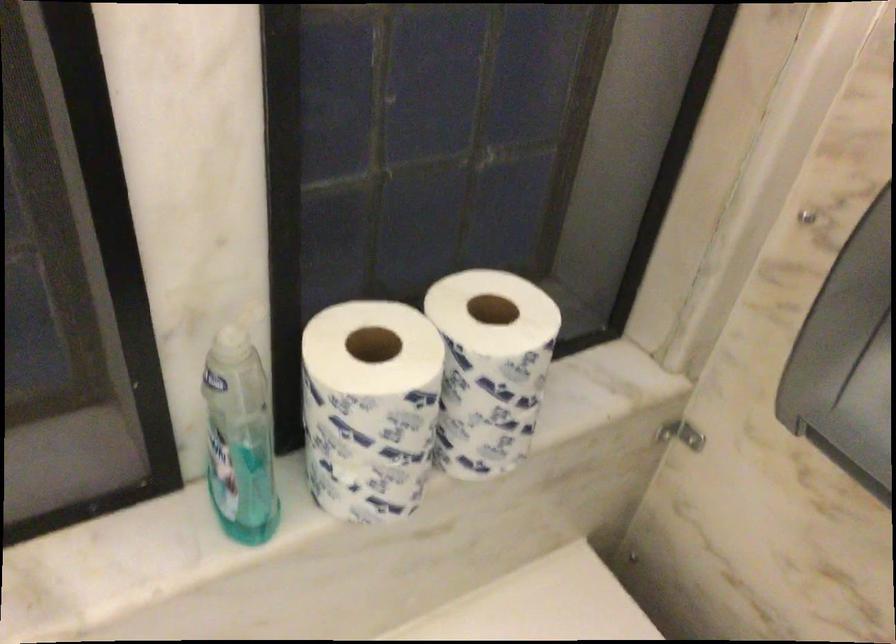
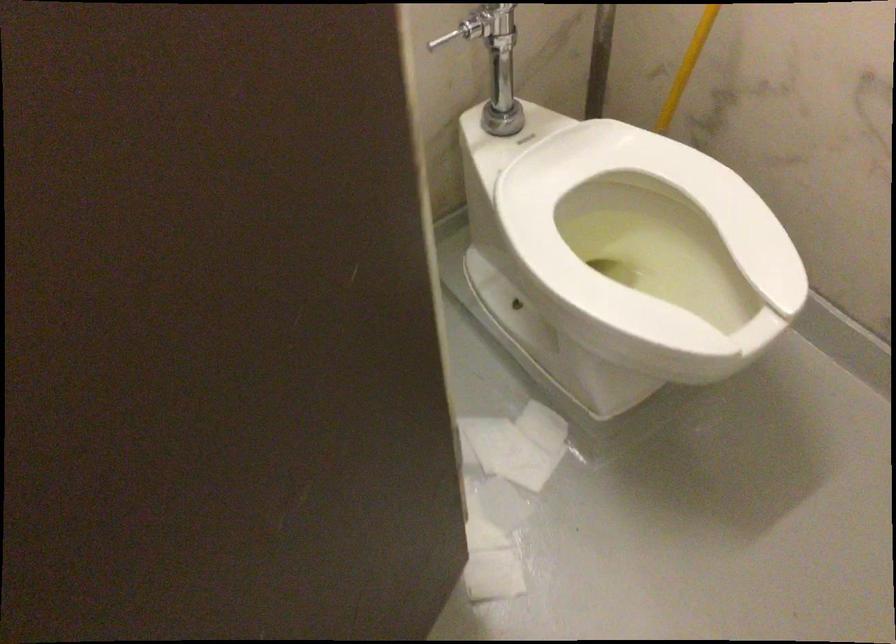
Question: What movement of the cameraman would produce the second image?

Choices:
 (A) Left
 (B) Right
 (C) Forward
 (D) Backward

Answer: (B)